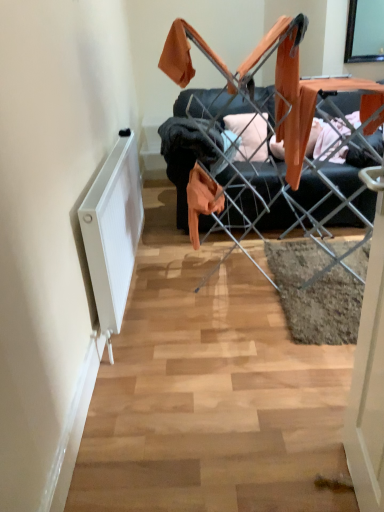
Describe the element at coordinates (113, 232) in the screenshot. I see `white matte radiator at left` at that location.

This screenshot has width=384, height=512. What are the coordinates of `white matte radiator at left` in the screenshot? It's located at (113, 232).

Identify the location of white matte radiator at left. The width and height of the screenshot is (384, 512). (113, 232).